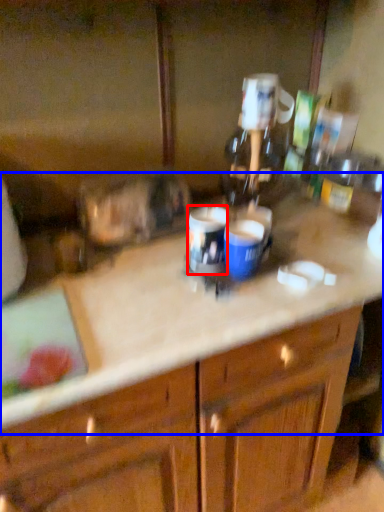
Question: Among these objects, which one is farthest to the camera, beverage (highlighted by a red box) or counter top (highlighted by a blue box)?

Choices:
 (A) beverage
 (B) counter top

Answer: (A)